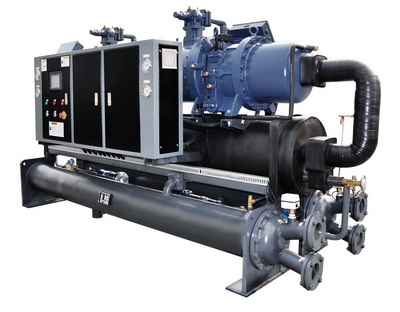
Where is `white label on  side of right cabinet`? white label on  side of right cabinet is located at coordinates (167, 60).